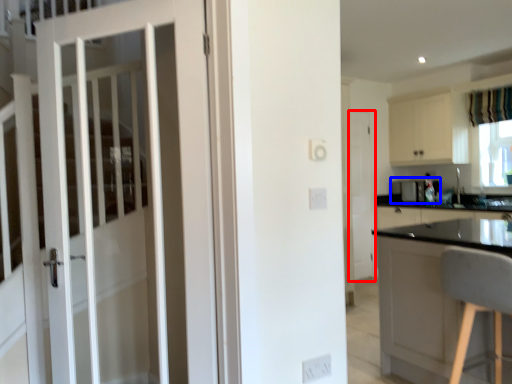
Question: Which of the following is the farthest to the observer, door (highlighted by a red box) or appliance (highlighted by a blue box)?

Choices:
 (A) door
 (B) appliance

Answer: (A)